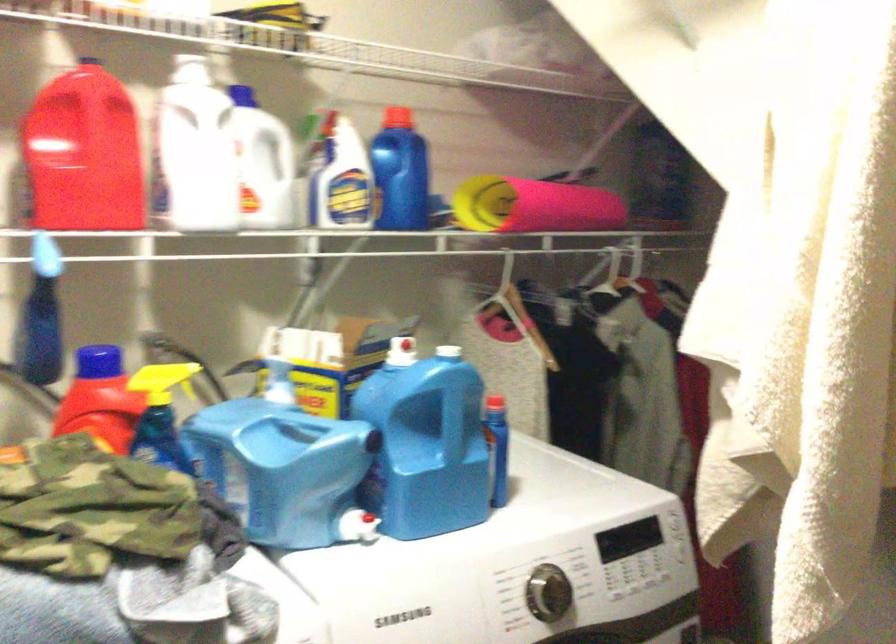
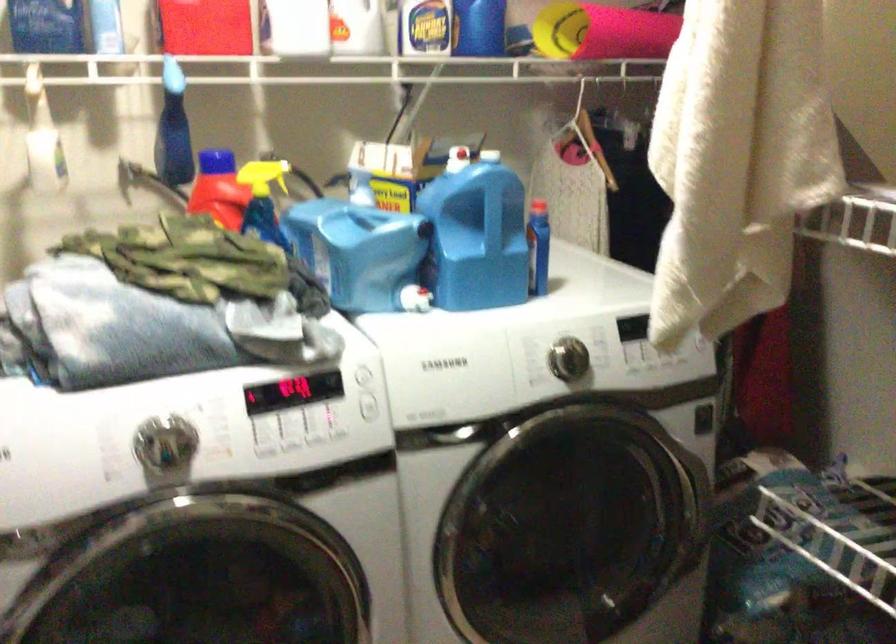
In the second image, find the point that corresponds to point (231, 194) in the first image.

(323, 28)